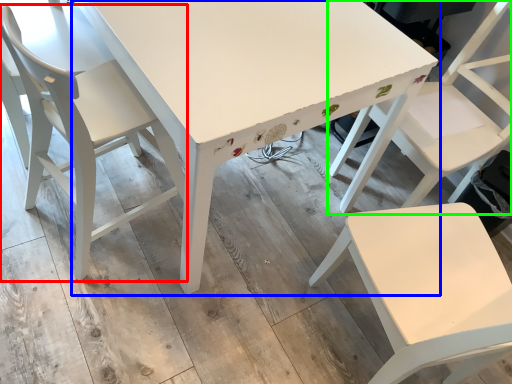
Question: Which is farther away from chair (highlighted by a red box)? table (highlighted by a blue box) or chair (highlighted by a green box)?

Choices:
 (A) table
 (B) chair

Answer: (B)